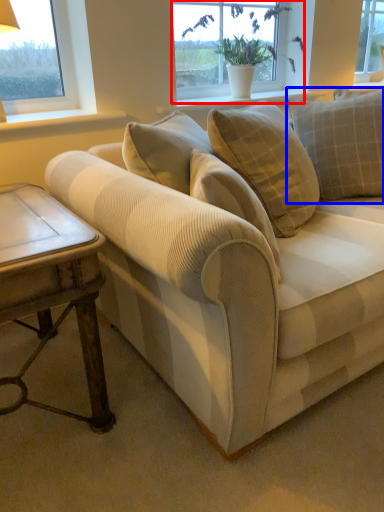
Question: Which point is further to the camera, window (highlighted by a red box) or pillow (highlighted by a blue box)?

Choices:
 (A) window
 (B) pillow

Answer: (A)